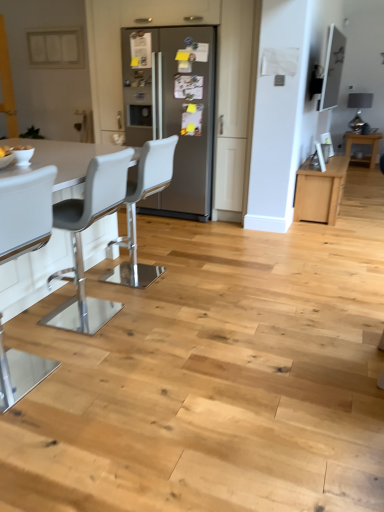
Where is `white plastic chair at left, positioned as the 3th chair in back-to-front order`? white plastic chair at left, positioned as the 3th chair in back-to-front order is located at coordinates (25, 213).

At what (x,y) coordinates should I click in order to perform the action: click on white leather bar stool at left, the second chair viewed from the back. Please return your answer as a coordinate pair (x, y). Looking at the image, I should click on (81, 240).

At what (x,y) coordinates should I click in order to perform the action: click on white plastic chair at center, positioned as the third chair in front-to-back order. Please return your answer as a coordinate pair (x, y). The width and height of the screenshot is (384, 512). Looking at the image, I should click on (135, 210).

Does white plastic chair at left, positioned as the 3th chair in back-to-front order, have a smaller size compared to white plastic chair at center, marked as the first chair in a back-to-front arrangement?

Correct, white plastic chair at left, positioned as the 3th chair in back-to-front order, occupies less space than white plastic chair at center, marked as the first chair in a back-to-front arrangement.

In the image, is white plastic chair at left, positioned as the 3th chair in back-to-front order, on the left side or the right side of white plastic chair at center, positioned as the third chair in front-to-back order?

white plastic chair at left, positioned as the 3th chair in back-to-front order, is positioned on white plastic chair at center, positioned as the third chair in front-to-back order,'s left side.

Which is correct: white plastic chair at left, arranged as the 1th chair when viewed from the front, is inside white plastic chair at center, marked as the first chair in a back-to-front arrangement, or outside of it?

white plastic chair at left, arranged as the 1th chair when viewed from the front, is outside white plastic chair at center, marked as the first chair in a back-to-front arrangement.

Does white plastic chair at left, positioned as the 3th chair in back-to-front order, come behind white plastic chair at center, positioned as the third chair in front-to-back order?

No, white plastic chair at left, positioned as the 3th chair in back-to-front order, is closer to the viewer.

From the image's perspective, is satin silver refrigerator at center positioned above or below white plastic chair at left, positioned as the 3th chair in back-to-front order?

From the image's perspective, satin silver refrigerator at center appears above white plastic chair at left, positioned as the 3th chair in back-to-front order.

Can you confirm if satin silver refrigerator at center is positioned to the right of white plastic chair at left, positioned as the 3th chair in back-to-front order?

Correct, you'll find satin silver refrigerator at center to the right of white plastic chair at left, positioned as the 3th chair in back-to-front order.

Is the surface of satin silver refrigerator at center in direct contact with white plastic chair at left, arranged as the 1th chair when viewed from the front?

No, satin silver refrigerator at center is not beside white plastic chair at left, arranged as the 1th chair when viewed from the front.

Does satin silver refrigerator at center lie in front of white plastic chair at left, positioned as the 3th chair in back-to-front order?

No.

Which of these two, light brown wood table at right or white plastic chair at center, marked as the first chair in a back-to-front arrangement, stands taller?

Standing taller between the two is white plastic chair at center, marked as the first chair in a back-to-front arrangement.

Is light brown wood table at right wider or thinner than white plastic chair at center, marked as the first chair in a back-to-front arrangement?

In the image, light brown wood table at right appears to be wider than white plastic chair at center, marked as the first chair in a back-to-front arrangement.

Which is closer, (380,135) or (130,189)?

The point (130,189) is closer to the camera.

Based on their sizes in the image, would you say light brown wood table at right is bigger or smaller than satin silver refrigerator at center?

Clearly, light brown wood table at right is smaller in size than satin silver refrigerator at center.

Between point (376, 148) and point (175, 170), which one is positioned behind?

The point (376, 148) is more distant.

Based on the photo, from the image's perspective, is light brown wood table at right located above satin silver refrigerator at center?

Yes, from the image's perspective, light brown wood table at right is above satin silver refrigerator at center.

From a real-world perspective, is light brown wood table at right physically above satin silver refrigerator at center?

No, from a real-world perspective, light brown wood table at right is not on top of satin silver refrigerator at center.

Considering the relative sizes of light brown wood table at right and white plastic chair at left, positioned as the 3th chair in back-to-front order, in the image provided, is light brown wood table at right taller than white plastic chair at left, positioned as the 3th chair in back-to-front order,?

No.

Does point (346, 153) come closer to viewer compared to point (26, 356)?

That is False.

How many degrees apart are the facing directions of light brown wood table at right and white plastic chair at left, positioned as the 3th chair in back-to-front order?

The angular difference between light brown wood table at right and white plastic chair at left, positioned as the 3th chair in back-to-front order, is 179 degrees.

Looking at their sizes, would you say white plastic chair at center, marked as the first chair in a back-to-front arrangement, is wider or thinner than satin silver refrigerator at center?

In the image, white plastic chair at center, marked as the first chair in a back-to-front arrangement, appears to be more narrow than satin silver refrigerator at center.

Is white plastic chair at center, marked as the first chair in a back-to-front arrangement, not close to satin silver refrigerator at center?

Indeed, white plastic chair at center, marked as the first chair in a back-to-front arrangement, is not near satin silver refrigerator at center.

Considering the sizes of white plastic chair at center, positioned as the third chair in front-to-back order, and satin silver refrigerator at center in the image, is white plastic chair at center, positioned as the third chair in front-to-back order, taller or shorter than satin silver refrigerator at center?

In the image, white plastic chair at center, positioned as the third chair in front-to-back order, appears to be shorter than satin silver refrigerator at center.

Based on the photo, in the image, is white plastic chair at center, positioned as the third chair in front-to-back order, on the left side or the right side of satin silver refrigerator at center?

white plastic chair at center, positioned as the third chair in front-to-back order, is to the left of satin silver refrigerator at center.

Which of these two, white plastic chair at center, marked as the first chair in a back-to-front arrangement, or white leather bar stool at left, which is the 2th chair from front to back, is thinner?

white plastic chair at center, marked as the first chair in a back-to-front arrangement, is thinner.

Is white plastic chair at center, marked as the first chair in a back-to-front arrangement, facing away from white leather bar stool at left, the second chair viewed from the back?

No, white plastic chair at center, marked as the first chair in a back-to-front arrangement,'s orientation is not away from white leather bar stool at left, the second chair viewed from the back.

Between white plastic chair at center, marked as the first chair in a back-to-front arrangement, and white leather bar stool at left, the second chair viewed from the back, which one appears on the left side from the viewer's perspective?

white leather bar stool at left, the second chair viewed from the back.

Would you say white leather bar stool at left, which is the 2th chair from front to back, is part of white plastic chair at center, positioned as the third chair in front-to-back order,'s contents?

No, white leather bar stool at left, which is the 2th chair from front to back, is not inside white plastic chair at center, positioned as the third chair in front-to-back order.

From a real-world perspective, count 2nd chairs upward from the white plastic chair at center, positioned as the third chair in front-to-back order, and point to it. Please provide its 2D coordinates.

[(25, 213)]

This screenshot has width=384, height=512. Find the location of `chair that is the 3rd one when counting forward from the satin silver refrigerator at center`. chair that is the 3rd one when counting forward from the satin silver refrigerator at center is located at coordinates (25, 213).

Based on their spatial positions, is satin silver refrigerator at center or light brown wood table at right further from white plastic chair at left, positioned as the 3th chair in back-to-front order?

light brown wood table at right is positioned further to the anchor white plastic chair at left, positioned as the 3th chair in back-to-front order.

Estimate the real-world distances between objects in this image. Which object is closer to white plastic chair at center, positioned as the third chair in front-to-back order, white leather bar stool at left, the second chair viewed from the back, or light brown wood table at right?

white leather bar stool at left, the second chair viewed from the back, lies closer to white plastic chair at center, positioned as the third chair in front-to-back order, than the other object.

Looking at the image, which one is located further to white leather bar stool at left, the second chair viewed from the back, white plastic chair at left, arranged as the 1th chair when viewed from the front, or white plastic chair at center, marked as the first chair in a back-to-front arrangement?

white plastic chair at left, arranged as the 1th chair when viewed from the front, is further to white leather bar stool at left, the second chair viewed from the back.

Estimate the real-world distances between objects in this image. Which object is further from satin silver refrigerator at center, light brown wood table at right or white plastic chair at left, arranged as the 1th chair when viewed from the front?

The object further to satin silver refrigerator at center is light brown wood table at right.

Which object lies further to the anchor point satin silver refrigerator at center, white plastic chair at left, arranged as the 1th chair when viewed from the front, or white plastic chair at center, marked as the first chair in a back-to-front arrangement?

white plastic chair at left, arranged as the 1th chair when viewed from the front, is further to satin silver refrigerator at center.

Which object lies nearer to the anchor point light brown wood table at right, satin silver refrigerator at center or white plastic chair at center, marked as the first chair in a back-to-front arrangement?

satin silver refrigerator at center.

Which object lies further to the anchor point satin silver refrigerator at center, white plastic chair at left, arranged as the 1th chair when viewed from the front, or light brown wood table at right?

light brown wood table at right lies further to satin silver refrigerator at center than the other object.

Estimate the real-world distances between objects in this image. Which object is further from satin silver refrigerator at center, white leather bar stool at left, which is the 2th chair from front to back, or light brown wood table at right?

Among the two, light brown wood table at right is located further to satin silver refrigerator at center.

Locate an element on the screen. The image size is (384, 512). chair positioned between white leather bar stool at left, which is the 2th chair from front to back, and satin silver refrigerator at center from near to far is located at coordinates pyautogui.click(x=135, y=210).

This screenshot has height=512, width=384. In order to click on fridge between white plastic chair at left, arranged as the 1th chair when viewed from the front, and light brown wood table at right, along the z-axis in this screenshot , I will do `click(174, 111)`.

At what (x,y) coordinates should I click in order to perform the action: click on chair between white leather bar stool at left, the second chair viewed from the back, and light brown wood table at right in the front-back direction. Please return your answer as a coordinate pair (x, y). This screenshot has width=384, height=512. Looking at the image, I should click on (135, 210).

In order to click on chair positioned between white plastic chair at left, positioned as the 3th chair in back-to-front order, and white plastic chair at center, marked as the first chair in a back-to-front arrangement, from near to far in this screenshot , I will do `click(81, 240)`.